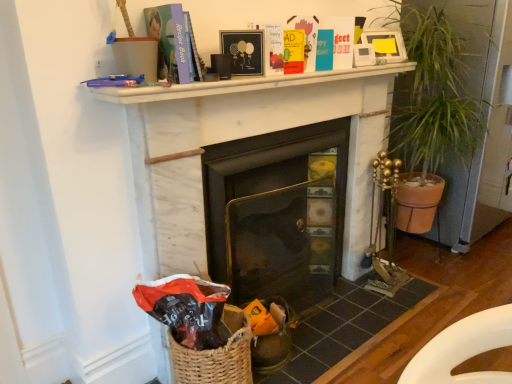
Question: Looking at their shapes, would you say green leafy plant at right is wider or thinner than black matte picture frame at upper center, the 1th picture frame in the front-to-back sequence?

Choices:
 (A) wide
 (B) thin

Answer: (A)

Question: Is green leafy plant at right inside the boundaries of black matte picture frame at upper center, the 2th picture frame viewed from the right, or outside?

Choices:
 (A) outside
 (B) inside

Answer: (A)

Question: Considering the real-world distances, which object is closest to the white matte shelf at upper center?

Choices:
 (A) black matte picture frame at upper center, the 2th picture frame viewed from the right
 (B) matte blue paper at upper center, which is the 1th paperback book from front to back
 (C) woven brown basket at lower left
 (D) yellow matte paperback book at upper center, acting as the 2th paperback book starting from the front
 (E) white marble fireplace at center, which appears as the second fireplace when viewed from the left

Answer: (E)

Question: Which object is the farthest from the matte white picture frame at upper right, the 1th picture frame viewed from the top?

Choices:
 (A) yellow matte paperback book at upper center, positioned as the second paperback book in left-to-right order
 (B) woven brown basket at lower left
 (C) white matte shelf at upper center
 (D) metallic black fireplace at center, the 2th fireplace viewed from the right
 (E) white marble fireplace at center, which appears as the second fireplace when viewed from the left

Answer: (B)